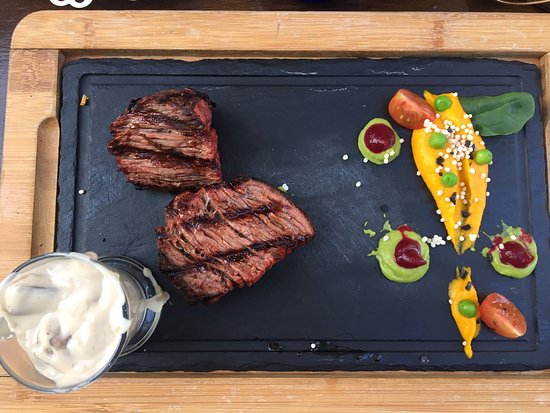
Locate an element on the screen. This screenshot has height=413, width=550. plate is located at coordinates (335, 194).